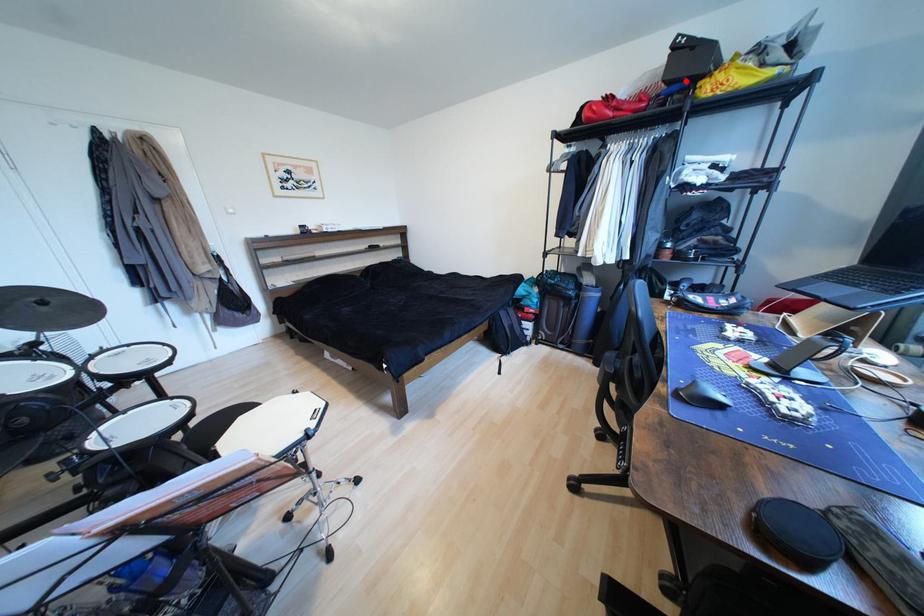
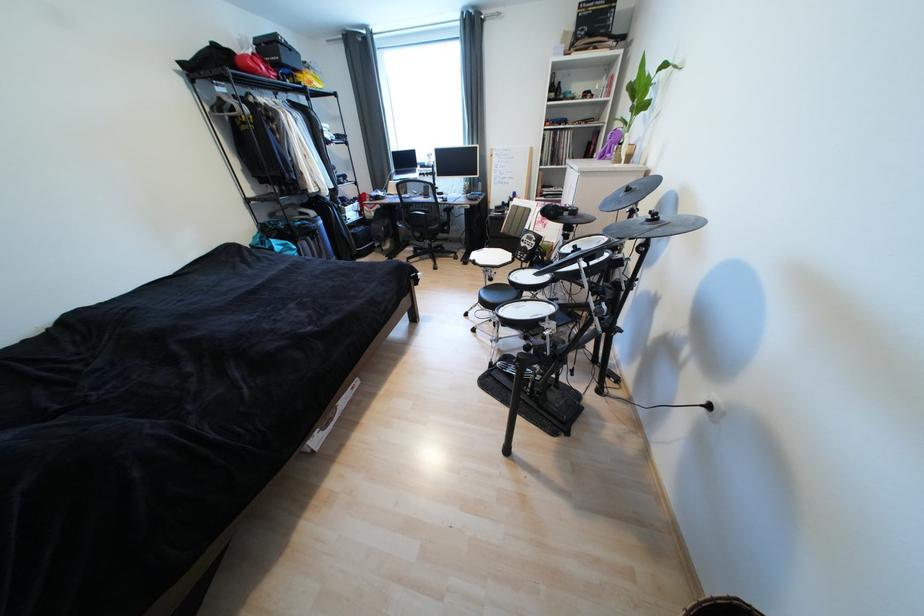
Where in the second image is the point corresponding to the highlighted location from the first image?

(294, 68)